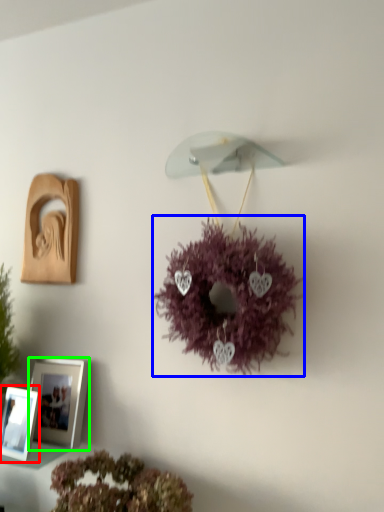
Question: Considering the real-world distances, which object is farthest from picture frame (highlighted by a red box)? flower (highlighted by a blue box) or picture frame (highlighted by a green box)?

Choices:
 (A) flower
 (B) picture frame

Answer: (A)